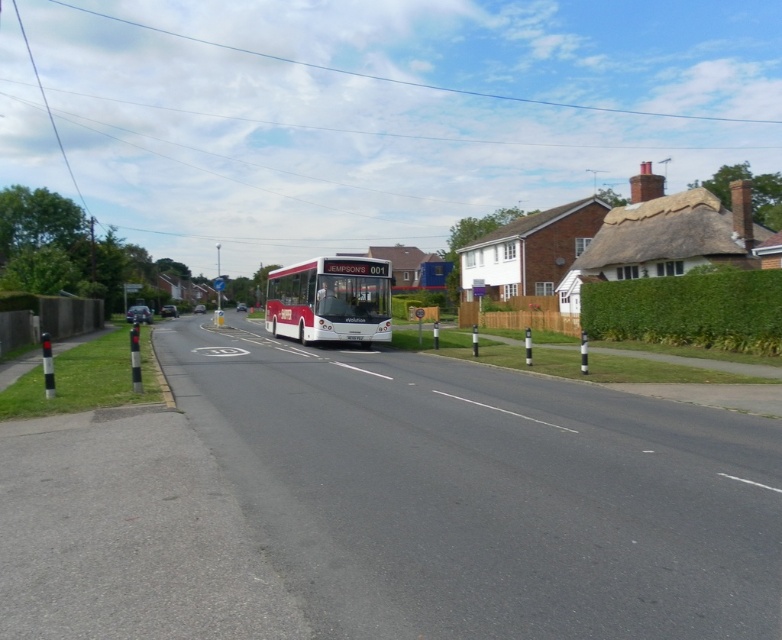
You are a pedestrian standing on the sidewalk and want to cross the road to reach the green leafy hedge at right. The matte red bus at center is blocking your view. Can you safely cross the road without being hit by the bus?

The green leafy hedge at right is located above the matte red bus at center, meaning the hedge is positioned higher up in the image. Since the bus is blocking your view, you cannot safely cross the road without risking being hit by the bus.

You are standing at the roundabout and want to take a photo of the red and white bus. Which point, point (732, 332) or point (289, 289), is closer to the camera to ensure the bus is in focus?

Point (732, 332) is closer to the camera than point (289, 289), so focusing on point (732, 332) will ensure the bus is in focus.